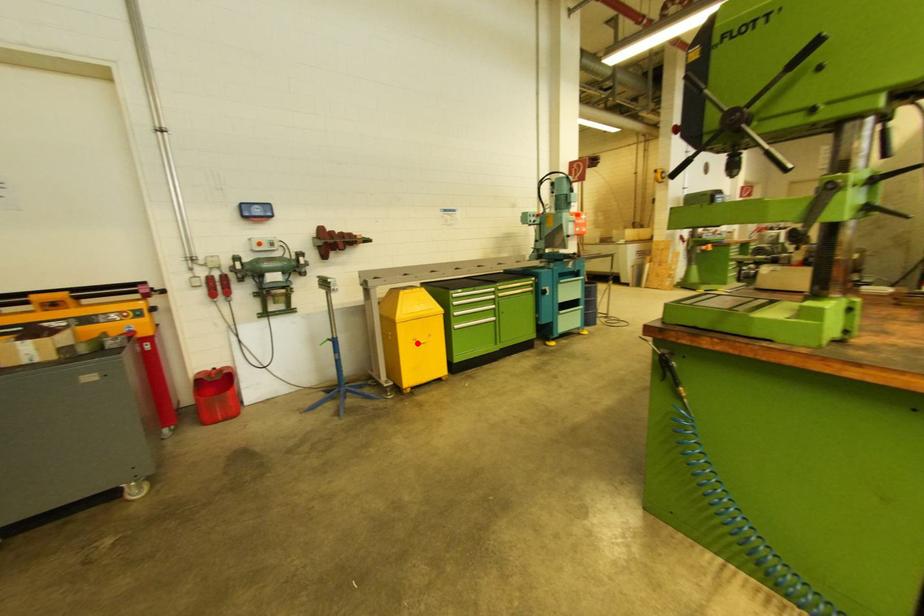
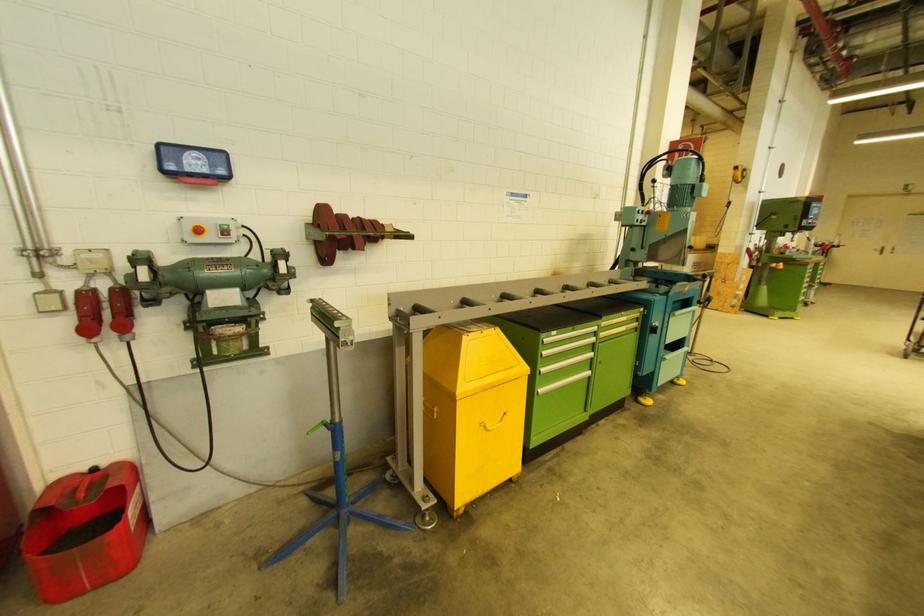
Where in the second image is the point corresponding to the highlighted location from the first image?

(488, 432)